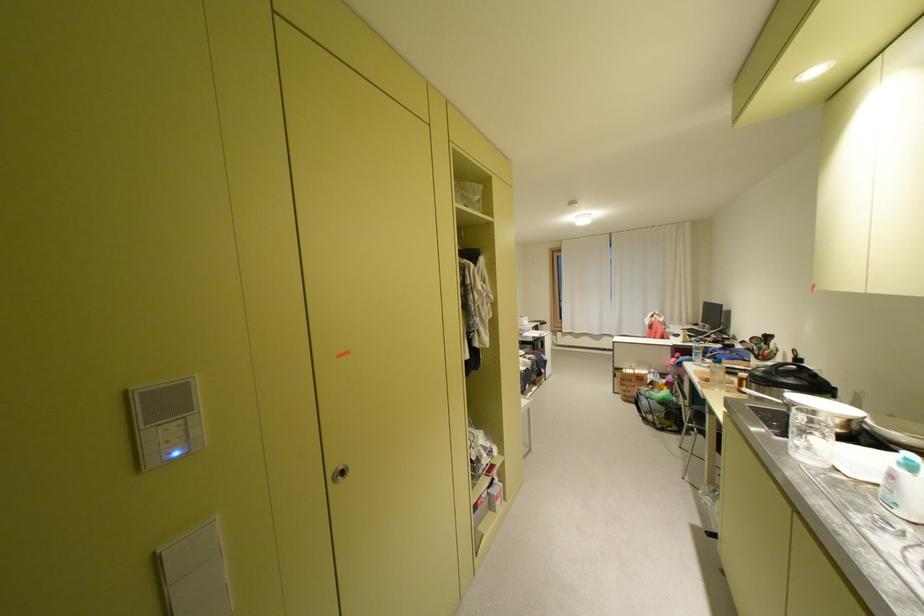
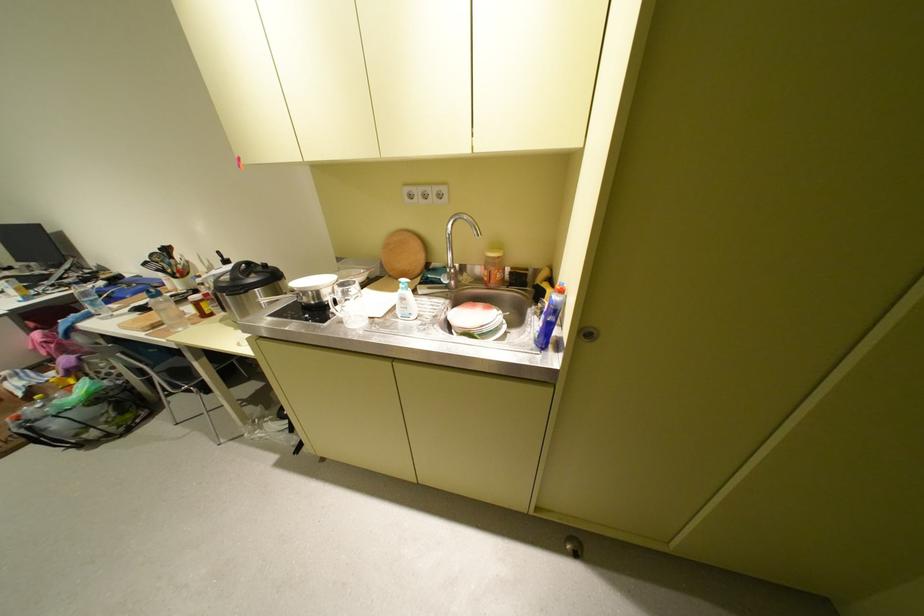
Locate, in the second image, the point that corresponds to point (774, 370) in the first image.

(237, 277)